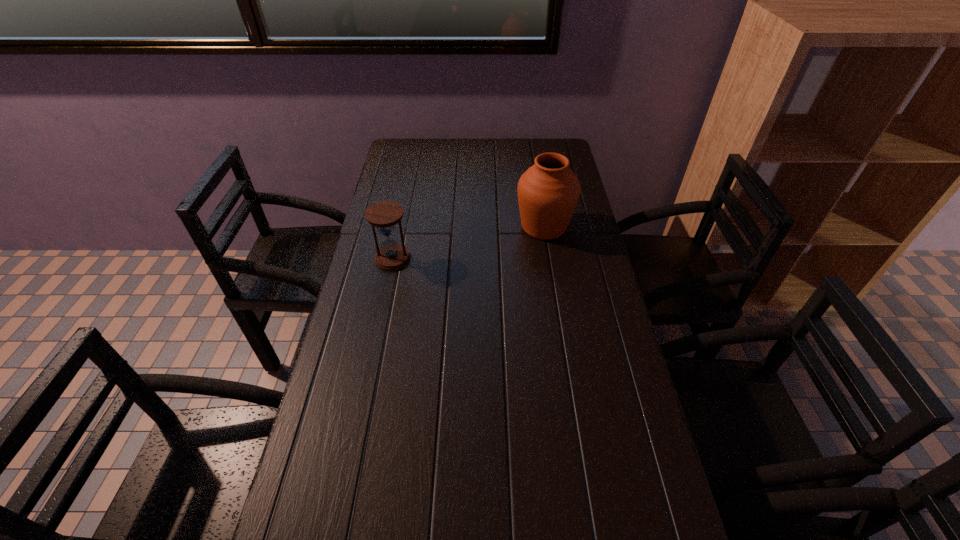
Identify the location of the taller object. This screenshot has height=540, width=960. (548, 192).

Identify the location of the right object. (548, 192).

Image resolution: width=960 pixels, height=540 pixels. I want to click on the shorter object, so click(x=384, y=215).

You are a GUI agent. You are given a task and a screenshot of the screen. Output one action in this format:
    pyautogui.click(x=<x>, y=<y>)
    Task: Click on the hourglass
    
    Given the screenshot: What is the action you would take?
    pyautogui.click(x=384, y=215)

The image size is (960, 540). Find the location of `free space located 0.190m on the front of the right object`. free space located 0.190m on the front of the right object is located at coordinates (554, 288).

This screenshot has width=960, height=540. I want to click on vacant space located on the front of the nearer object, so click(384, 303).

In order to click on object that is at the left edge in this screenshot , I will do `click(384, 215)`.

Identify the location of object at the right edge. Image resolution: width=960 pixels, height=540 pixels. (548, 192).

The width and height of the screenshot is (960, 540). What are the coordinates of `vacant area at the far edge of the desktop` in the screenshot? It's located at (456, 168).

In the image, there is a desktop. Where is `vacant space at the left edge`? The image size is (960, 540). vacant space at the left edge is located at coordinates (392, 286).